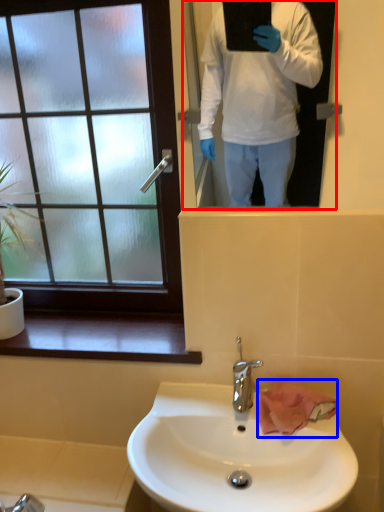
Question: Which of the following is the closest to the observer, mirror (highlighted by a red box) or hand towel (highlighted by a blue box)?

Choices:
 (A) mirror
 (B) hand towel

Answer: (A)